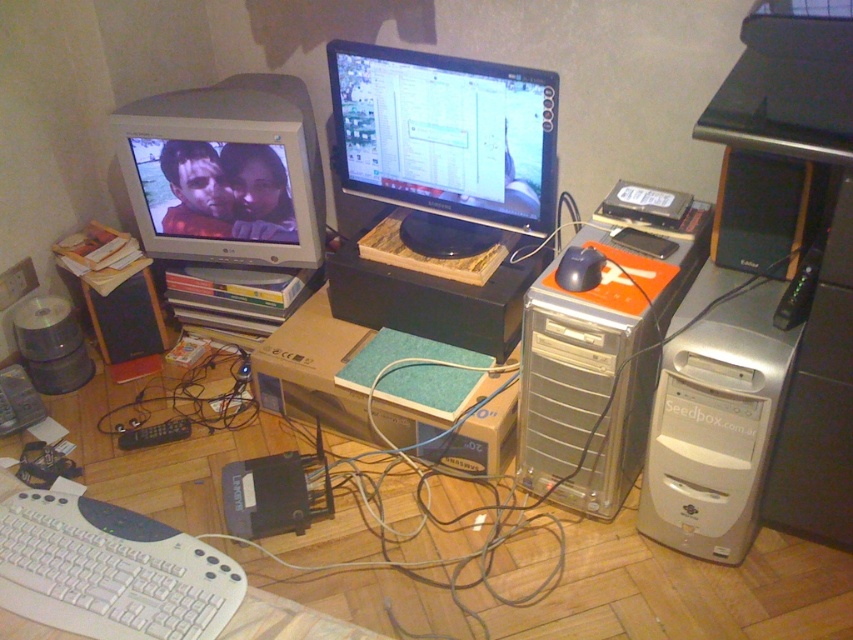
You are a technician who needs to connect the white plastic keyboard at lower left to the matte black monitor at center. The keyboard has a USB cable that is 1 meter long. Can the cable reach the monitor without needing an extension?

The matte black monitor at center is 1.25 meters away from the white plastic keyboard at lower left. Since the USB cable is only 1 meter long, it is not long enough to connect the keyboard to the monitor without an extension.